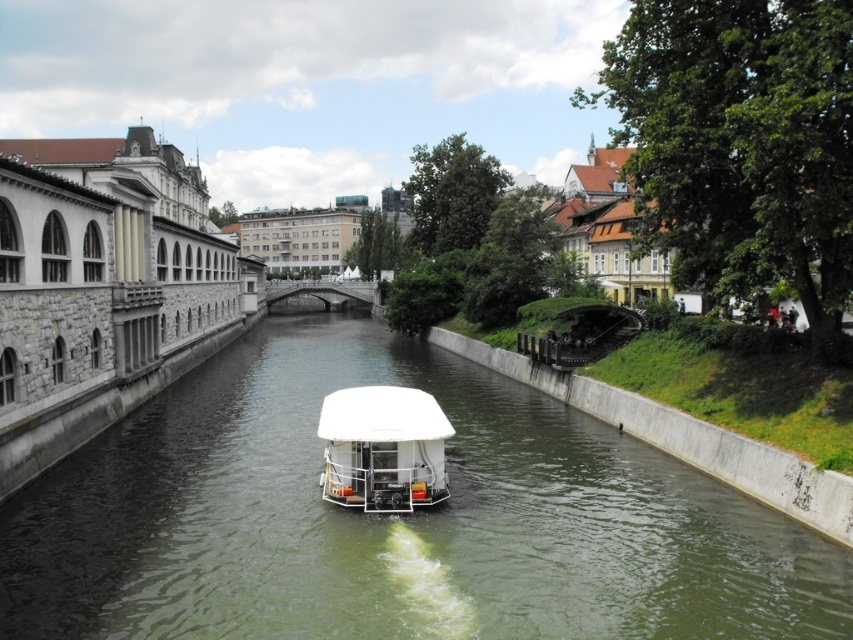
Can you confirm if green concrete river at center is positioned to the right of white matte boat at center?

Indeed, green concrete river at center is positioned on the right side of white matte boat at center.

Find the location of a particular element. The width and height of the screenshot is (853, 640). green concrete river at center is located at coordinates (393, 518).

Find the location of a particular element. The image size is (853, 640). green concrete river at center is located at coordinates (393, 518).